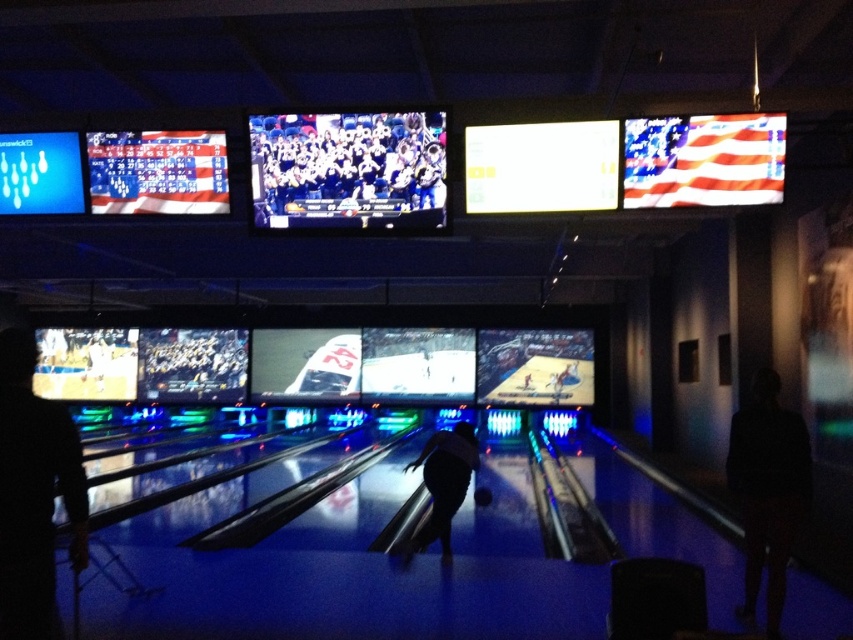
Consider the image. You are a photographer standing in the bowling alley and want to take a photo of the white fabric group at center and the black fabric at left. Which object is located to the right of the other?

The white fabric group at center is positioned on the right side of black fabric at left.